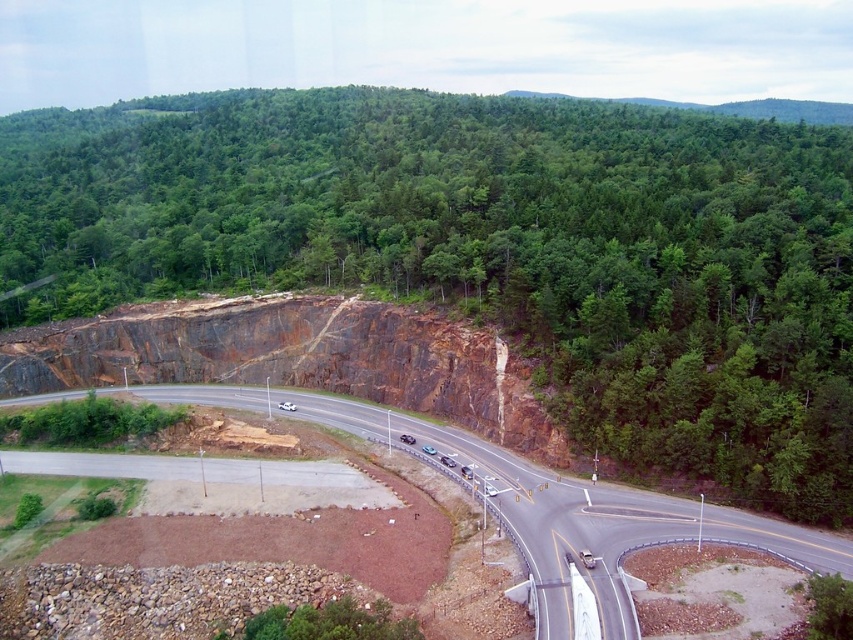
Based on the photo, you are driving a car that is 15 feet long and want to park between the green leafy tree at center and the asphalt road at center. Is there enough space between them to park your car?

The distance between the green leafy tree at center and the asphalt road at center is 334.12 feet. Since your car is only 15 feet long, there is ample space to park between them.

You are a driver approaching the green leafy tree at center and the asphalt road at center. Which object is higher in elevation?

The green leafy tree at center is above the asphalt road at center, so it is higher in elevation.

You are a driver approaching the green leafy tree at center and the asphalt road at center. Which object is taller when viewed from the road?

The green leafy tree at center is taller than the asphalt road at center, so the tree appears taller when viewed from the road.